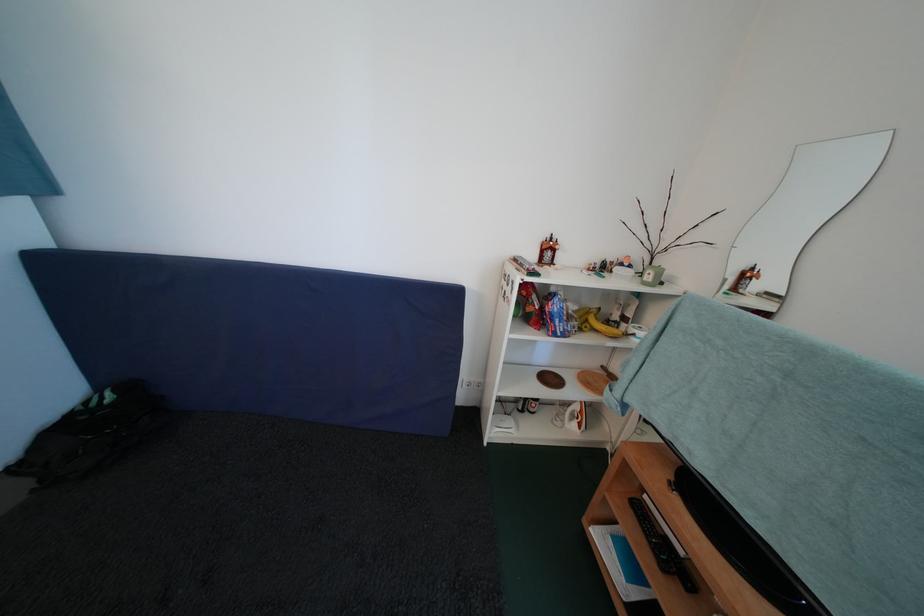
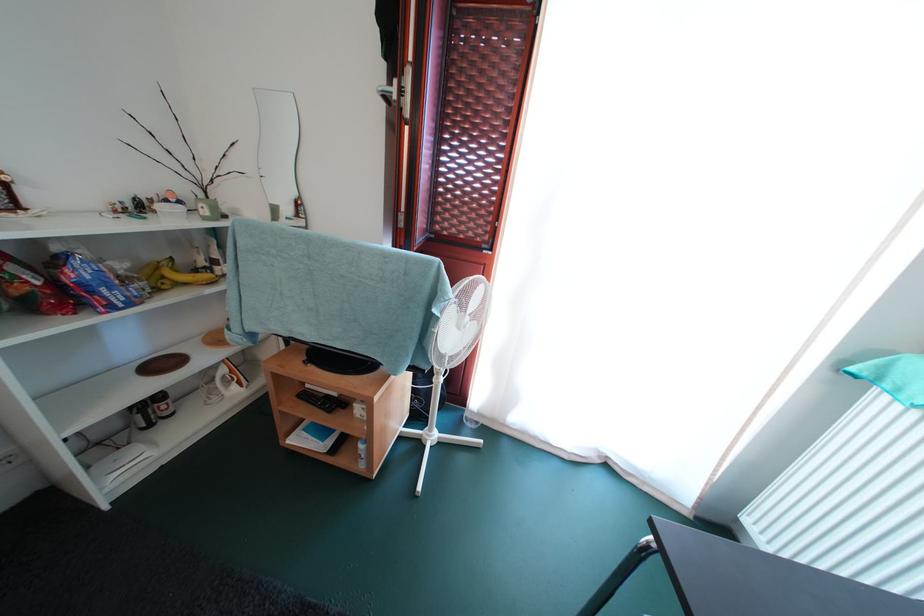
Question: I am providing you with two images of the same scene from different viewpoints. Which of the following objects are not visible in image2?

Choices:
 (A) bunch of bananas
 (B) blue food bag
 (C) white spray bottle
 (D) none of these

Answer: (D)